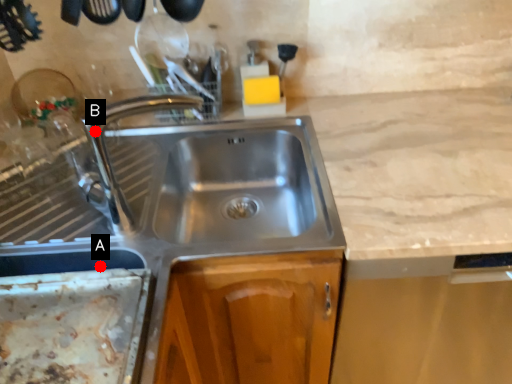
Question: Two points are circled on the image, labeled by A and B beside each circle. Which point is closer to the camera taking this photo?

Choices:
 (A) A is closer
 (B) B is closer

Answer: (A)